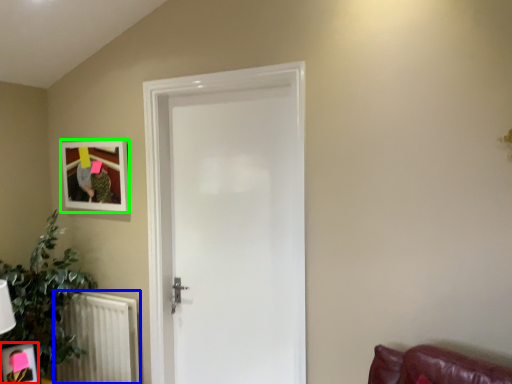
Question: Which is nearer to the picture frame (highlighted by a red box)? radiator (highlighted by a blue box) or picture frame (highlighted by a green box).

Choices:
 (A) radiator
 (B) picture frame

Answer: (A)